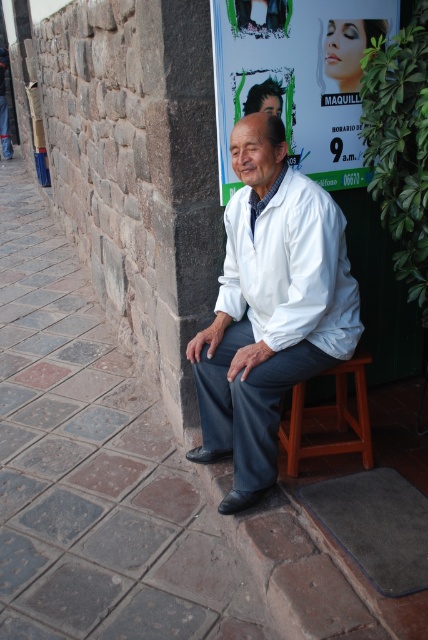
You are a photographer standing in front of the man in the image. You want to take a photo that captures both the white smooth coat at center and the white smooth dress shirt at center clearly. Which clothing item will appear closer to you in the photo?

The white smooth coat at center will appear closer to you in the photo because it is positioned further to the viewer compared to the white smooth dress shirt at center.

You are a photographer trying to capture the man in the image. To ensure the focus is on his white smooth coat at center, which is located at point (270, 307), where should you aim the camera?

You should aim the camera at the point (270, 307) where the white smooth coat at center is located to ensure proper focus.

You are a delivery person who needs to place a package on the brown wooden stool at lower center. You are currently standing at the matte white poster at upper center. Can you reach the stool without moving from your current position?

The distance between the matte white poster at upper center and the brown wooden stool at lower center is 3.49 feet. Since you are standing at the matte white poster at upper center, you would need to move approximately 3.49 feet towards the stool to place the package, so you cannot reach it without moving.